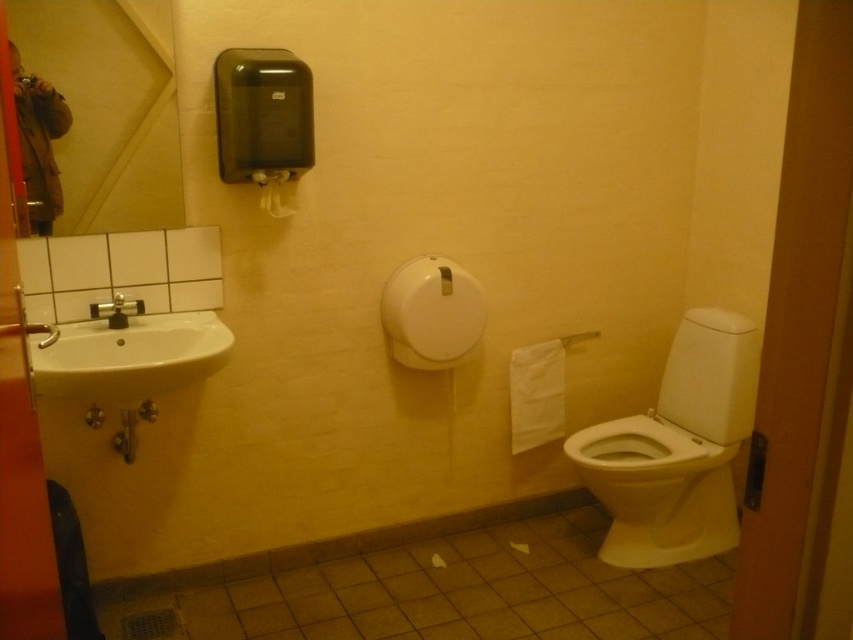
You are a plumber trying to fix a leak in the bathroom. You need to access the pipes behind the white glossy toilet at lower right and the brushed metal faucet at left. Which object requires you to move a larger obstruction because of its size?

The white glossy toilet at lower right requires moving a larger obstruction because it has a larger size compared to the brushed metal faucet at left.

You are a housekeeper checking the bathroom layout. You need to place a new decorative plant pot between the white matte toilet paper at upper center and the brushed metal faucet at left. Based on their positions, where should the plant pot be placed?

The white matte toilet paper at upper center is positioned over the brushed metal faucet at left, so the plant pot should be placed between them horizontally, below the white matte toilet paper at upper center and above the brushed metal faucet at left.